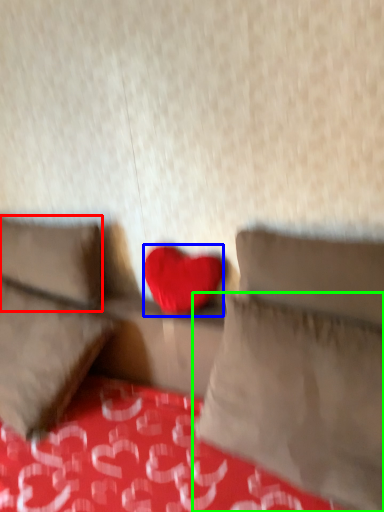
Question: Estimate the real-world distances between objects in this image. Which object is farther from pillow (highlighted by a red box), heart (highlighted by a blue box) or pillow (highlighted by a green box)?

Choices:
 (A) heart
 (B) pillow

Answer: (B)